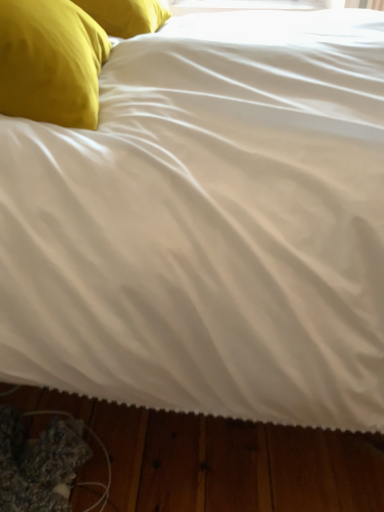
Question: Should I look upward or downward to see yellow fabric pillow at upper left, which ranks as the 2th pillow in back-to-front order?

Choices:
 (A) up
 (B) down

Answer: (A)

Question: Can you confirm if yellow fabric pillow at upper left, marked as the 1th pillow in a bottom-to-top arrangement, is positioned to the right of matte yellow pillow at upper left, which appears as the 2th pillow when viewed from the front?

Choices:
 (A) no
 (B) yes

Answer: (A)

Question: Considering the relative sizes of yellow fabric pillow at upper left, marked as the 1th pillow in a bottom-to-top arrangement, and matte yellow pillow at upper left, the second pillow in the bottom-to-top sequence, in the image provided, is yellow fabric pillow at upper left, marked as the 1th pillow in a bottom-to-top arrangement, thinner than matte yellow pillow at upper left, the second pillow in the bottom-to-top sequence,?

Choices:
 (A) no
 (B) yes

Answer: (B)

Question: Is yellow fabric pillow at upper left, the 1th pillow positioned from the front, facing towards matte yellow pillow at upper left, the first pillow positioned from the back?

Choices:
 (A) yes
 (B) no

Answer: (B)

Question: Is yellow fabric pillow at upper left, marked as the 1th pillow in a bottom-to-top arrangement, not inside matte yellow pillow at upper left, the first pillow positioned from the back?

Choices:
 (A) yes
 (B) no

Answer: (A)

Question: Can you see yellow fabric pillow at upper left, marked as the 1th pillow in a bottom-to-top arrangement, touching matte yellow pillow at upper left, which appears as the 2th pillow when viewed from the front?

Choices:
 (A) no
 (B) yes

Answer: (A)

Question: From the image's perspective, is yellow fabric pillow at upper left, marked as the 1th pillow in a bottom-to-top arrangement, below matte yellow pillow at upper left, the second pillow in the bottom-to-top sequence?

Choices:
 (A) yes
 (B) no

Answer: (A)

Question: Would you say matte yellow pillow at upper left, the first pillow positioned from the back, is outside yellow fabric pillow at upper left, marked as the 1th pillow in a bottom-to-top arrangement?

Choices:
 (A) yes
 (B) no

Answer: (A)

Question: Does matte yellow pillow at upper left, the first pillow positioned from the back, appear on the right side of yellow fabric pillow at upper left, which ranks as the 2th pillow in back-to-front order?

Choices:
 (A) no
 (B) yes

Answer: (B)

Question: Can you confirm if matte yellow pillow at upper left, the second pillow in the bottom-to-top sequence, is positioned to the left of yellow fabric pillow at upper left, the 1th pillow positioned from the front?

Choices:
 (A) no
 (B) yes

Answer: (A)

Question: Can you confirm if matte yellow pillow at upper left, which appears as the 1th pillow when viewed from the top, is wider than yellow fabric pillow at upper left, the 1th pillow positioned from the front?

Choices:
 (A) no
 (B) yes

Answer: (B)

Question: Is matte yellow pillow at upper left, which appears as the 1th pillow when viewed from the top, oriented away from yellow fabric pillow at upper left, the 2th pillow in the top-to-bottom sequence?

Choices:
 (A) yes
 (B) no

Answer: (B)

Question: Considering the relative positions of matte yellow pillow at upper left, the second pillow in the bottom-to-top sequence, and yellow fabric pillow at upper left, which ranks as the 2th pillow in back-to-front order, in the image provided, is matte yellow pillow at upper left, the second pillow in the bottom-to-top sequence, behind yellow fabric pillow at upper left, which ranks as the 2th pillow in back-to-front order,?

Choices:
 (A) no
 (B) yes

Answer: (B)

Question: Is yellow fabric pillow at upper left, marked as the 1th pillow in a bottom-to-top arrangement, taller or shorter than matte yellow pillow at upper left, the first pillow positioned from the back?

Choices:
 (A) tall
 (B) short

Answer: (A)